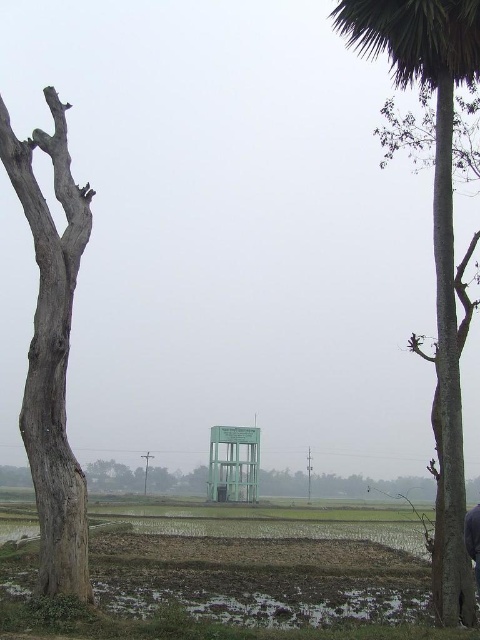
You are a farmer planning to plant a new row of crops between the green leafy palm tree at right and the gray rough bark tree at left. Considering their widths, which tree will require more space to avoid overcrowding?

The green leafy palm tree at right has a larger width than the gray rough bark tree at left, so it will require more space to avoid overcrowding.

You are a farmer checking the field. You notice the gray rough bark tree at left and the muddy wet field at lower center. Which one is higher in elevation?

The gray rough bark tree at left is taller than the muddy wet field at lower center, so it is higher in elevation.